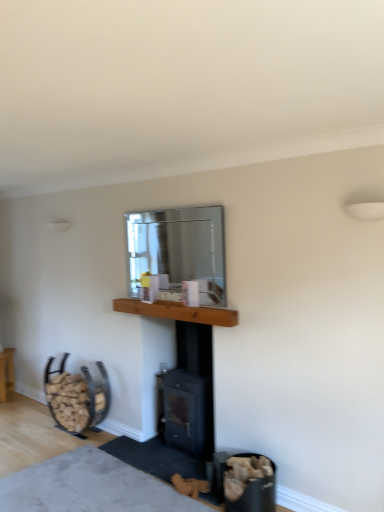
Where is `soft gray carpet at lower center`? This screenshot has height=512, width=384. soft gray carpet at lower center is located at coordinates (90, 487).

Measure the distance between point (7,381) and camera.

The distance of point (7,381) from camera is 15.76 feet.

Measure the distance between clear glass mirror at upper center and camera.

They are 2.92 meters apart.

Where is `soft gray carpet at lower center`? soft gray carpet at lower center is located at coordinates (90, 487).

Which object is positioned more to the right, black matte wood burning stove at center or soft gray carpet at lower center?

From the viewer's perspective, black matte wood burning stove at center appears more on the right side.

Is black matte wood burning stove at center oriented away from soft gray carpet at lower center?

That's not correct — black matte wood burning stove at center is not looking away from soft gray carpet at lower center.

Based on the photo, what's the angular difference between black matte wood burning stove at center and soft gray carpet at lower center's facing directions?

There is a 177-degree angle between the facing directions of black matte wood burning stove at center and soft gray carpet at lower center.

From a real-world perspective, which is physically below, black matte wood burning stove at center or soft gray carpet at lower center?

From a 3D spatial view, soft gray carpet at lower center is below.

Considering the relative sizes of wooden at left and clear glass mirror at upper center in the image provided, is wooden at left wider than clear glass mirror at upper center?

Correct, the width of wooden at left exceeds that of clear glass mirror at upper center.

From a real-world perspective, relative to clear glass mirror at upper center, is wooden at left vertically above or below?

From a real-world perspective, wooden at left is physically below clear glass mirror at upper center.

From the image's perspective, relative to clear glass mirror at upper center, is wooden at left above or below?

Clearly, from the image's perspective, wooden at left is below clear glass mirror at upper center.

Can you confirm if wooden at left is shorter than soft gray carpet at lower center?

In fact, wooden at left may be taller than soft gray carpet at lower center.

Is wooden at left to the right of soft gray carpet at lower center from the viewer's perspective?

No, wooden at left is not to the right of soft gray carpet at lower center.

From a real-world perspective, is wooden at left on top of soft gray carpet at lower center?

Indeed, from a real-world perspective, wooden at left stands above soft gray carpet at lower center.

Measure the distance between wooden at left and soft gray carpet at lower center.

The distance of wooden at left from soft gray carpet at lower center is 29.11 inches.

The width and height of the screenshot is (384, 512). In order to click on plain that appears in front of the wooden log basket at lower left in this screenshot , I will do `click(90, 487)`.

Is wooden log basket at lower left to the right of soft gray carpet at lower center from the viewer's perspective?

Incorrect, wooden log basket at lower left is not on the right side of soft gray carpet at lower center.

Between point (8, 377) and point (27, 505), which one is positioned in front?

The point (27, 505) is closer to the camera.

Can you confirm if wooden log basket at lower left is taller than soft gray carpet at lower center?

Yes, wooden log basket at lower left is taller than soft gray carpet at lower center.

Considering the relative sizes of wooden log basket at lower left and wooden at left in the image provided, is wooden log basket at lower left taller than wooden at left?

No, wooden log basket at lower left is not taller than wooden at left.

Locate an element on the screen. furniture below the wooden at left (from the image's perspective) is located at coordinates (6, 373).

Is wooden log basket at lower left oriented towards wooden at left?

No, wooden log basket at lower left is not aimed at wooden at left.

Which of these two, wooden log basket at lower left or wooden at left, is bigger?

With larger size is wooden at left.

Is wooden log basket at lower left taller than black matte wood burning stove at center?

Incorrect, the height of wooden log basket at lower left is not larger of that of black matte wood burning stove at center.

Is wooden log basket at lower left further to the viewer compared to black matte wood burning stove at center?

That is True.

Is black matte wood burning stove at center surrounded by wooden log basket at lower left?

That's incorrect, black matte wood burning stove at center is not inside wooden log basket at lower left.

Does clear glass mirror at upper center lie in front of wooden log basket at lower left?

Yes, it is.

Is clear glass mirror at upper center wider than wooden log basket at lower left?

In fact, clear glass mirror at upper center might be narrower than wooden log basket at lower left.

Is clear glass mirror at upper center oriented away from wooden log basket at lower left?

clear glass mirror at upper center is not turned away from wooden log basket at lower left.

Is wooden log basket at lower left surrounded by clear glass mirror at upper center?

That's incorrect, wooden log basket at lower left is not inside clear glass mirror at upper center.

Locate an element on the screen. Image resolution: width=384 pixels, height=512 pixels. wood burning stove behind the soft gray carpet at lower center is located at coordinates (190, 392).

Identify the location of window screen above the wooden at left (from a real-world perspective). pos(178,247).

Looking at the image, which one is located closer to soft gray carpet at lower center, wooden at left or clear glass mirror at upper center?

wooden at left.

Based on their spatial positions, is black matte wood burning stove at center or wooden log basket at lower left further from soft gray carpet at lower center?

wooden log basket at lower left lies further to soft gray carpet at lower center than the other object.

Based on their spatial positions, is soft gray carpet at lower center or wooden at left closer to wooden log basket at lower left?

wooden at left.

Based on their spatial positions, is soft gray carpet at lower center or black matte wood burning stove at center closer to wooden mantle at center?

The object closer to wooden mantle at center is black matte wood burning stove at center.

When comparing their distances from clear glass mirror at upper center, does soft gray carpet at lower center or wooden log basket at lower left seem closer?

Among the two, soft gray carpet at lower center is located nearer to clear glass mirror at upper center.

From the image, which object appears to be farther from black matte wood burning stove at center, wooden log basket at lower left or wooden at left?

wooden log basket at lower left lies further to black matte wood burning stove at center than the other object.

Which object lies further to the anchor point soft gray carpet at lower center, clear glass mirror at upper center or wooden at left?

Based on the image, clear glass mirror at upper center appears to be further to soft gray carpet at lower center.

Estimate the real-world distances between objects in this image. Which object is further from wooden mantle at center, soft gray carpet at lower center or clear glass mirror at upper center?

soft gray carpet at lower center is further to wooden mantle at center.

Where is `counter top that lies between clear glass mirror at upper center and wooden at left from top to bottom`? The height and width of the screenshot is (512, 384). counter top that lies between clear glass mirror at upper center and wooden at left from top to bottom is located at coordinates (178, 312).

In order to click on swivel chair situated between wooden log basket at lower left and black matte wood burning stove at center from left to right in this screenshot , I will do `click(76, 397)`.

At what (x,y) coordinates should I click in order to perform the action: click on counter top positioned between soft gray carpet at lower center and black matte wood burning stove at center from near to far. Please return your answer as a coordinate pair (x, y). This screenshot has width=384, height=512. Looking at the image, I should click on (178, 312).

Locate an element on the screen. wood burning stove positioned between soft gray carpet at lower center and wooden at left from near to far is located at coordinates (190, 392).